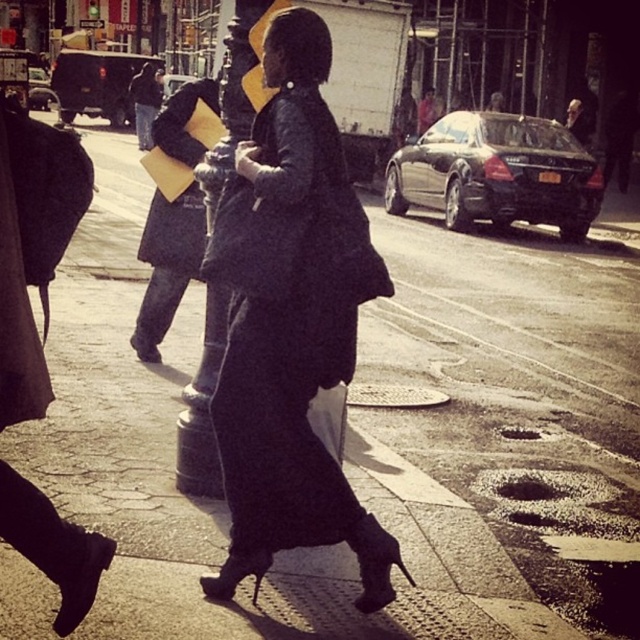
You are a delivery person needing to deliver a package to the person wearing the black matte robe at center. There is also a person wearing the matte black coat at center nearby. Given that your delivery vehicle is 7 feet wide, can you safely maneuver between them to reach the robe wearer without hitting the coat wearer?

The distance between the black matte robe at center and the matte black coat at center is 8.84 feet. Since your vehicle is 7 feet wide, there is enough space to maneuver between them safely.

You are a delivery person trying to deliver a package to the person wearing the black matte robe at center and the matte black coat at center. Which one is closer to you so you can hand the package first?

The black matte robe at center is in front of the matte black coat at center, so the black matte robe at center is closer to you and you should hand the package to them first.

Where is the black matte robe at center located in the image?

The black matte robe at center is located at point (289, 324) in the image.